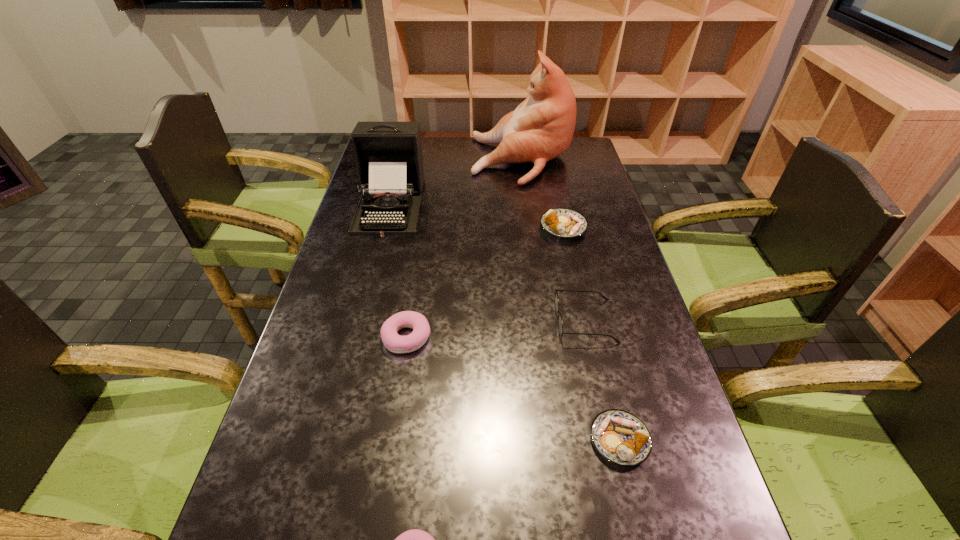
Locate an element on the screen. object at the far edge is located at coordinates (541, 128).

The height and width of the screenshot is (540, 960). In order to click on object at the left edge in this screenshot , I will do tap(388, 155).

Locate an element on the screen. This screenshot has width=960, height=540. cat located at the right edge is located at coordinates (541, 128).

Locate an element on the screen. Image resolution: width=960 pixels, height=540 pixels. spectacles present at the right edge is located at coordinates (560, 323).

Find the location of `object positioned at the far right corner`. object positioned at the far right corner is located at coordinates (541, 128).

Locate an element on the screen. vacant space at the far edge of the desktop is located at coordinates (470, 156).

Find the location of `free space at the left edge of the desktop`. free space at the left edge of the desktop is located at coordinates (346, 411).

You are a GUI agent. You are given a task and a screenshot of the screen. Output one action in this format:
    pyautogui.click(x=<x>, y=<y>)
    Task: Click on the free space at the right edge of the desktop
    This screenshot has height=540, width=960.
    Given the screenshot: What is the action you would take?
    pyautogui.click(x=675, y=500)

Find the location of a particular element. vacant space at the far right corner of the desktop is located at coordinates (583, 146).

The image size is (960, 540). I want to click on empty space that is in between the cat and the smaller brown pastry, so click(x=570, y=300).